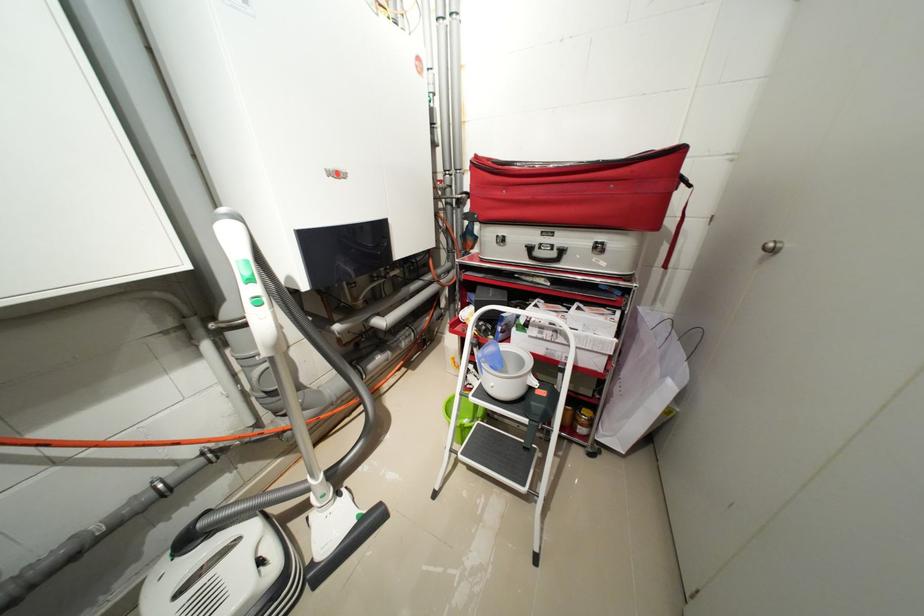
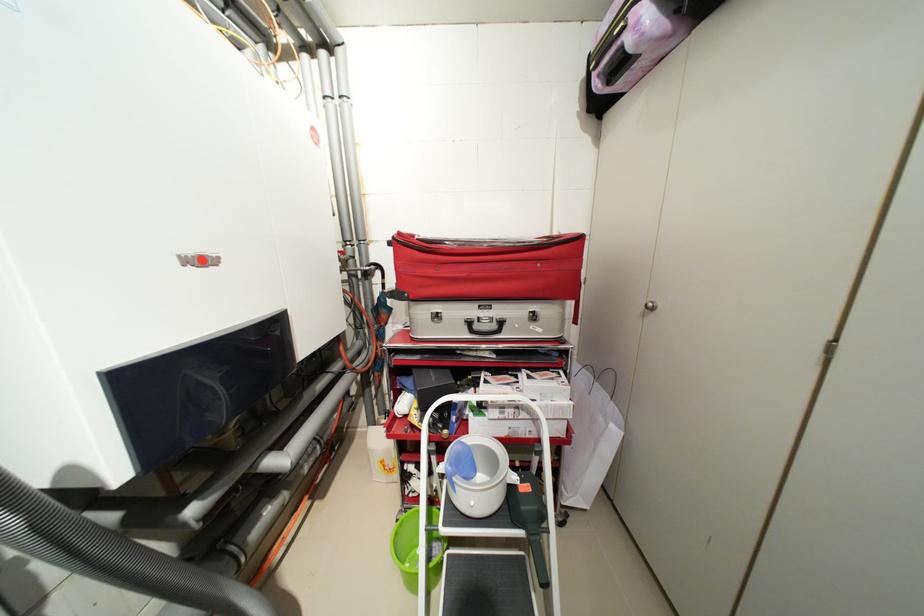
Find the pixel in the second image that matches [561,254] in the first image.

(502, 326)